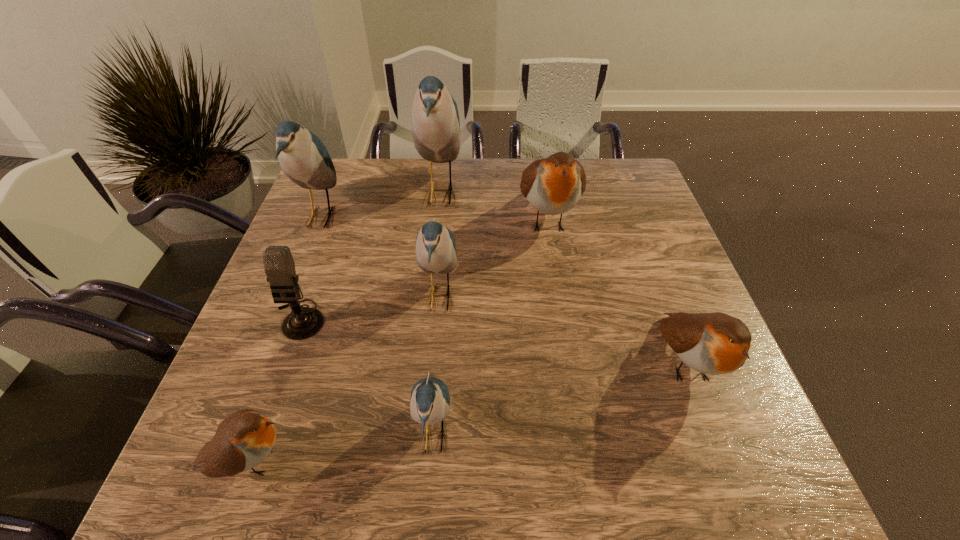
The width and height of the screenshot is (960, 540). In order to click on vacant area situated at the face of the shortest bird in this screenshot , I will do `click(353, 461)`.

Locate an element on the screen. Image resolution: width=960 pixels, height=540 pixels. microphone at the left edge is located at coordinates (303, 322).

Locate an element on the screen. The width and height of the screenshot is (960, 540). object that is at the right edge is located at coordinates (715, 343).

This screenshot has height=540, width=960. What are the coordinates of `object that is at the far left corner` in the screenshot? It's located at (303, 157).

Locate an element on the screen. The image size is (960, 540). object at the near left corner is located at coordinates (244, 439).

At what (x,y) coordinates should I click in order to perform the action: click on vacant space at the far edge of the desktop. Please return your answer as a coordinate pair (x, y). The width and height of the screenshot is (960, 540). Looking at the image, I should click on (508, 164).

In the image, there is a desktop. Identify the location of vacant area at the near edge. (526, 458).

At what (x,y) coordinates should I click in order to perform the action: click on free region at the left edge of the desktop. Please return your answer as a coordinate pair (x, y). The height and width of the screenshot is (540, 960). Looking at the image, I should click on (269, 408).

The image size is (960, 540). In the image, there is a desktop. Identify the location of vacant space at the right edge. (668, 260).

Find the location of a particular element. The height and width of the screenshot is (540, 960). free space at the far left corner of the desktop is located at coordinates (340, 184).